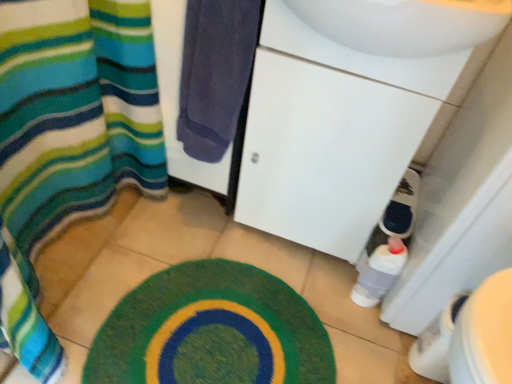
Question: Is striped fabric shower curtain at left taller than translucent plastic bottle at lower right?

Choices:
 (A) yes
 (B) no

Answer: (B)

Question: Can you confirm if striped fabric shower curtain at left is positioned to the right of translucent plastic bottle at lower right?

Choices:
 (A) yes
 (B) no

Answer: (B)

Question: Is striped fabric shower curtain at left positioned before translucent plastic bottle at lower right?

Choices:
 (A) no
 (B) yes

Answer: (A)

Question: From a real-world perspective, does striped fabric shower curtain at left sit lower than translucent plastic bottle at lower right?

Choices:
 (A) no
 (B) yes

Answer: (B)

Question: Is striped fabric shower curtain at left with translucent plastic bottle at lower right?

Choices:
 (A) no
 (B) yes

Answer: (A)

Question: In the image, is striped fabric shower curtain at left positioned in front of or behind dark blue towel at center?

Choices:
 (A) front
 (B) behind

Answer: (B)

Question: Based on their sizes in the image, would you say striped fabric shower curtain at left is bigger or smaller than dark blue towel at center?

Choices:
 (A) small
 (B) big

Answer: (A)

Question: Would you say striped fabric shower curtain at left is inside or outside dark blue towel at center?

Choices:
 (A) inside
 (B) outside

Answer: (B)

Question: Considering the positions of striped fabric shower curtain at left and dark blue towel at center in the image, is striped fabric shower curtain at left taller or shorter than dark blue towel at center?

Choices:
 (A) tall
 (B) short

Answer: (B)

Question: Relative to green fuzzy bath mat at lower center, is white glossy sink at center in front or behind?

Choices:
 (A) behind
 (B) front

Answer: (B)

Question: Based on their sizes in the image, would you say white glossy sink at center is bigger or smaller than green fuzzy bath mat at lower center?

Choices:
 (A) big
 (B) small

Answer: (A)

Question: Is white glossy sink at center situated inside green fuzzy bath mat at lower center or outside?

Choices:
 (A) outside
 (B) inside

Answer: (A)

Question: From their relative heights in the image, would you say white glossy sink at center is taller or shorter than green fuzzy bath mat at lower center?

Choices:
 (A) tall
 (B) short

Answer: (A)

Question: From their relative heights in the image, would you say green fuzzy bath mat at lower center is taller or shorter than white glossy sink at center?

Choices:
 (A) short
 (B) tall

Answer: (A)

Question: Is green fuzzy bath mat at lower center bigger or smaller than white glossy sink at center?

Choices:
 (A) small
 (B) big

Answer: (A)